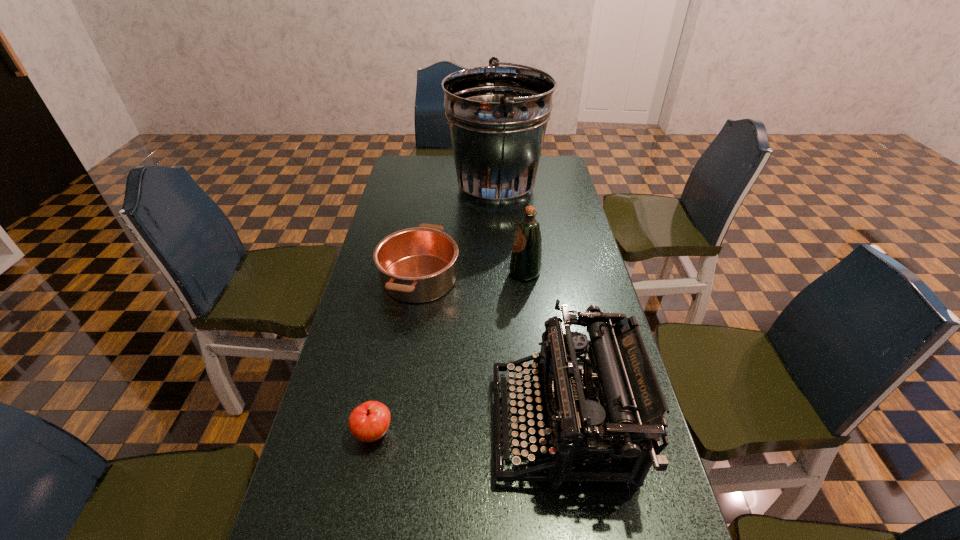
The image size is (960, 540). In order to click on object that is at the far right corner in this screenshot , I will do `click(497, 115)`.

What are the coordinates of `free space at the far edge` in the screenshot? It's located at (454, 168).

Image resolution: width=960 pixels, height=540 pixels. In the image, there is a desktop. Find the location of `free space at the left edge`. free space at the left edge is located at coordinates (420, 210).

You are a GUI agent. You are given a task and a screenshot of the screen. Output one action in this format:
    pyautogui.click(x=<x>, y=<y>)
    Task: Click on the vacant space at the right edge of the desktop
    The height and width of the screenshot is (540, 960).
    Given the screenshot: What is the action you would take?
    [x=549, y=235]

I want to click on free space at the far left corner, so click(x=412, y=176).

In order to click on free space at the far right corner of the desktop in this screenshot , I will do `click(536, 176)`.

What are the coordinates of `vacant area that lies between the saucepan and the typewriter` in the screenshot? It's located at (491, 351).

Locate an element on the screen. empty space between the typewriter and the farthest object is located at coordinates (529, 306).

Find the location of a particular element. The height and width of the screenshot is (540, 960). empty location between the apple and the typewriter is located at coordinates (468, 428).

The width and height of the screenshot is (960, 540). In order to click on free point between the saucepan and the apple in this screenshot , I will do [x=396, y=355].